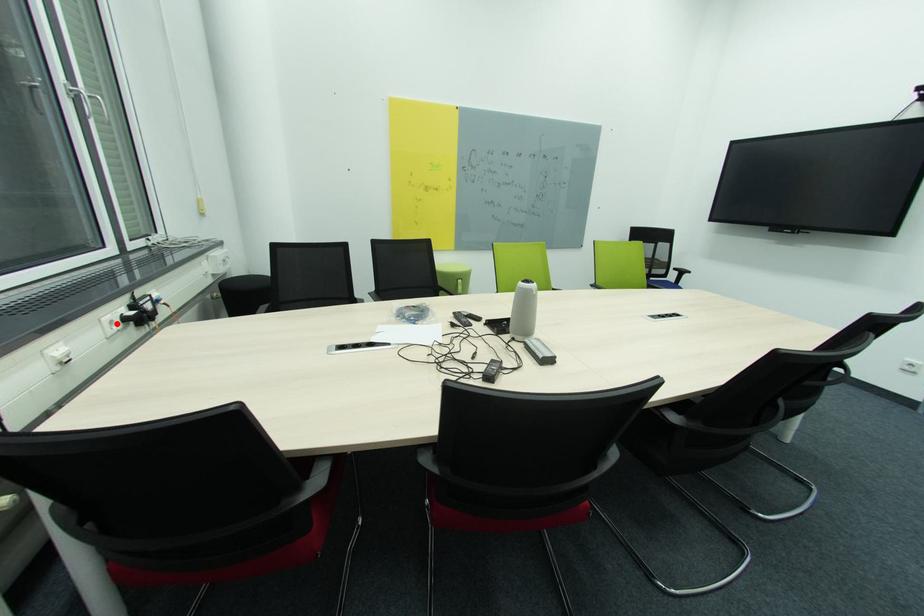
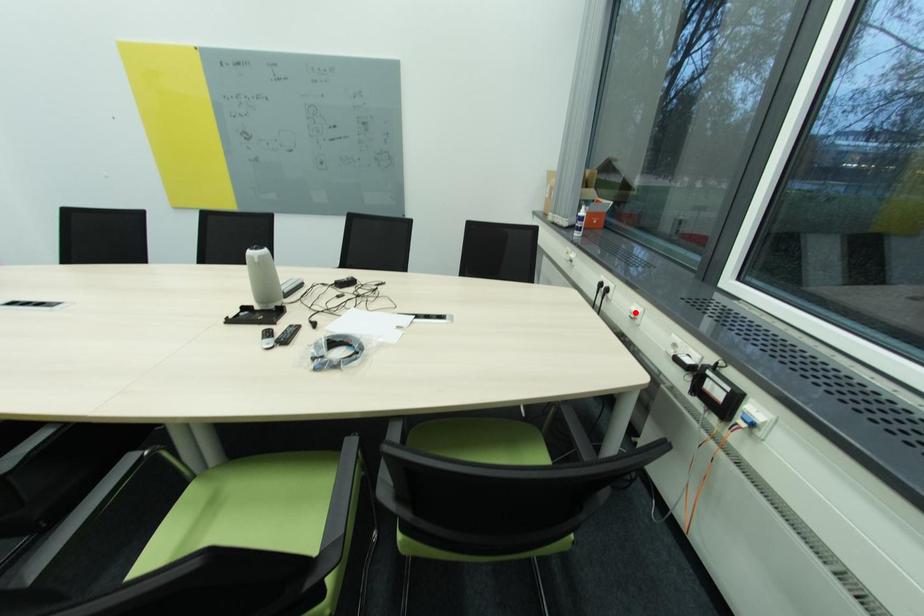
I am providing you with two images of the same scene from different viewpoints. A red point is marked on the first image and another point is marked on the second image. Is the marked point in image1 the same physical position as the marked point in image2?

No